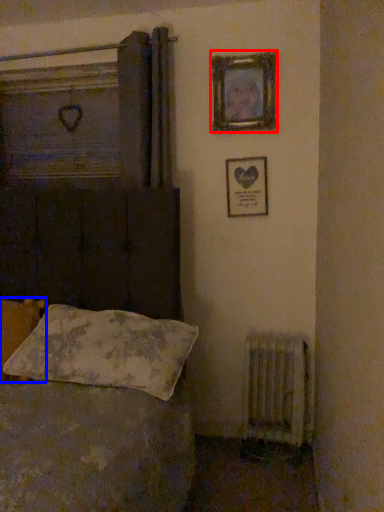
Question: Among these objects, which one is farthest to the camera, picture frame (highlighted by a red box) or pillow (highlighted by a blue box)?

Choices:
 (A) picture frame
 (B) pillow

Answer: (A)